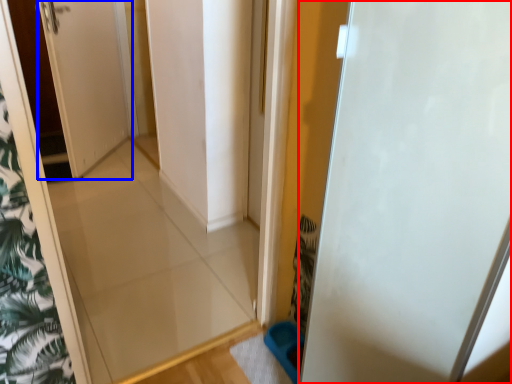
Question: Which object appears farthest to the camera in this image, door (highlighted by a red box) or door (highlighted by a blue box)?

Choices:
 (A) door
 (B) door

Answer: (B)